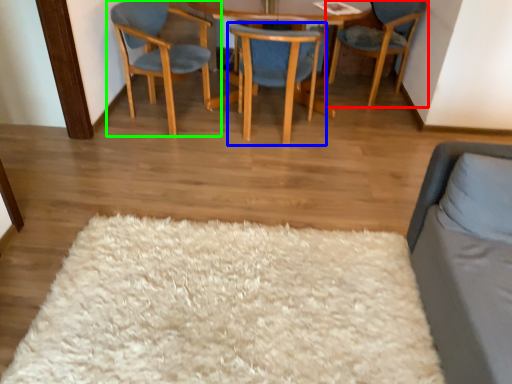
Question: Based on their relative distances, which object is nearer to chair (highlighted by a red box)? Choose from chair (highlighted by a blue box) and chair (highlighted by a green box).

Choices:
 (A) chair
 (B) chair

Answer: (A)